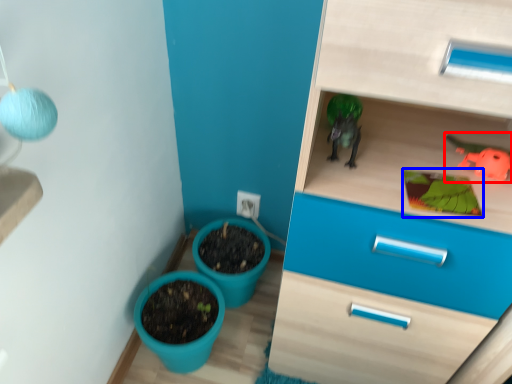
Question: Among these objects, which one is farthest to the camera, toy (highlighted by a red box) or plant (highlighted by a blue box)?

Choices:
 (A) toy
 (B) plant

Answer: (A)